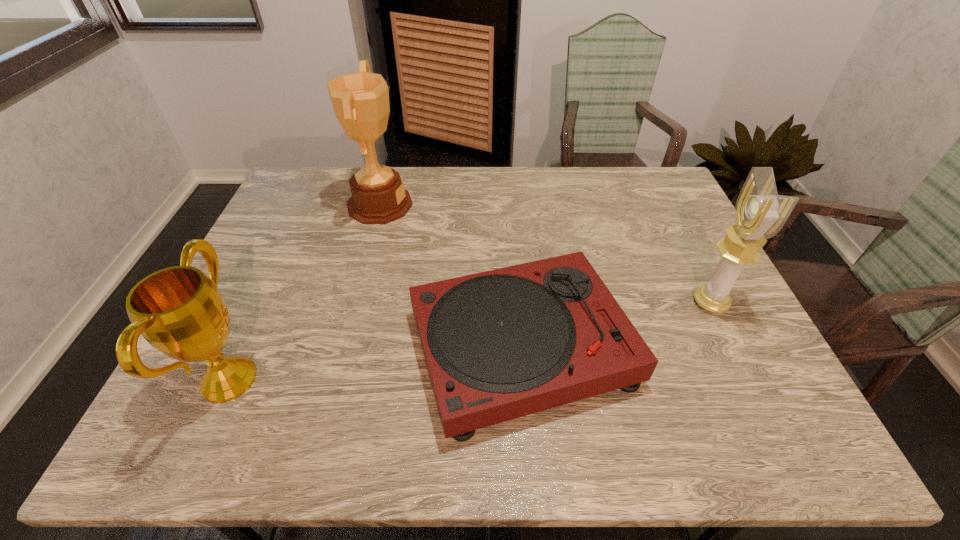
In the image, there is a desktop. Where is `vacant space at the far edge`? vacant space at the far edge is located at coordinates (535, 180).

This screenshot has height=540, width=960. I want to click on free space at the near edge, so click(708, 431).

The height and width of the screenshot is (540, 960). In the image, there is a desktop. Identify the location of vacant space at the left edge. (252, 359).

Find the location of `blank space at the right edge of the desktop`. blank space at the right edge of the desktop is located at coordinates (762, 378).

Locate an element on the screen. vacant space at the far left corner is located at coordinates (343, 171).

In the image, there is a desktop. At what (x,y) coordinates should I click in order to perform the action: click on vacant space at the near left corner. Please return your answer as a coordinate pair (x, y). This screenshot has height=540, width=960. Looking at the image, I should click on (215, 435).

The height and width of the screenshot is (540, 960). Find the location of `free space between the farthest object and the leftmost award`. free space between the farthest object and the leftmost award is located at coordinates (304, 292).

Find the location of `unoccupied area between the nearest award and the farthest award`. unoccupied area between the nearest award and the farthest award is located at coordinates tap(304, 292).

This screenshot has height=540, width=960. I want to click on vacant region between the shortest award and the second award from right to left, so click(x=304, y=292).

Identify the location of vacant area between the farthest object and the third object from left to right. This screenshot has width=960, height=540. (451, 276).